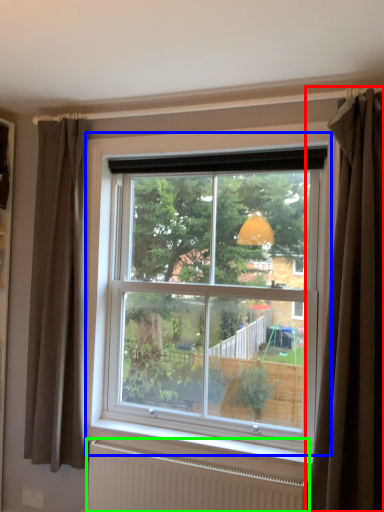
Question: Which object is positioned closest to curtain (highlighted by a red box)? Select from window (highlighted by a blue box) and radiator (highlighted by a green box).

Choices:
 (A) window
 (B) radiator

Answer: (A)